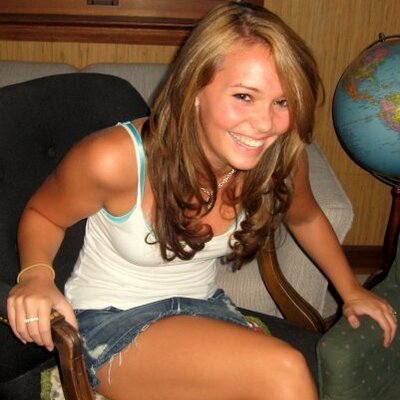
Find the location of `globe`. globe is located at coordinates (384, 108).